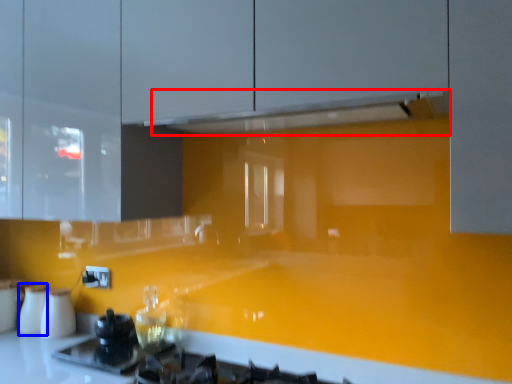
Question: Among these objects, which one is farthest to the camera, exhaust hood (highlighted by a red box) or appliance (highlighted by a blue box)?

Choices:
 (A) exhaust hood
 (B) appliance

Answer: (B)